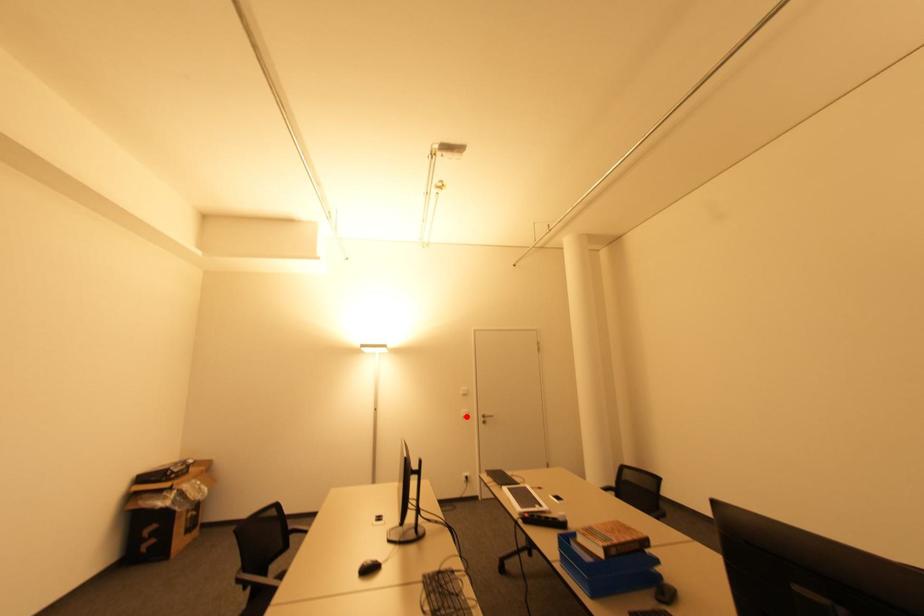
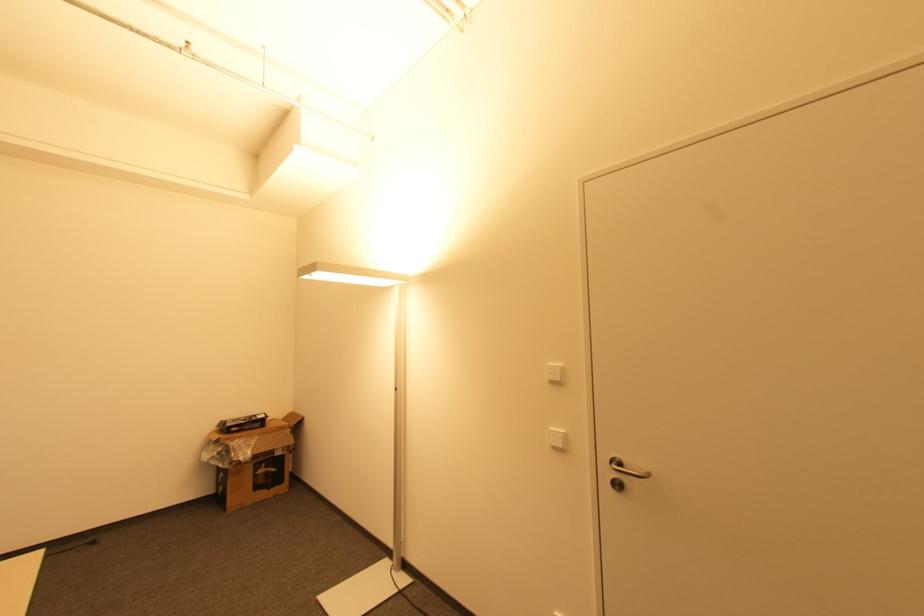
Question: I am providing you with two images of the same scene from different viewpoints. Given a red point in image1, look at the same physical point in image2. Is it:

Choices:
 (A) Closer to the viewpoint
 (B) Farther from the viewpoint

Answer: (A)